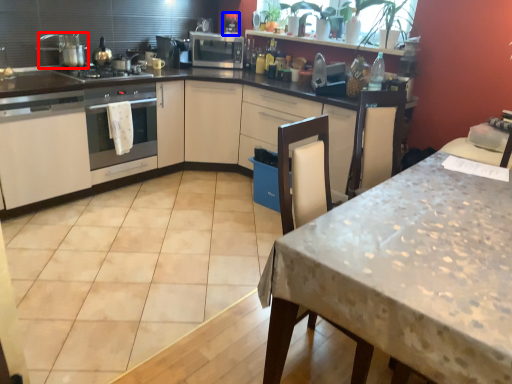
Question: Among these objects, which one is farthest to the camera, kitchen appliance (highlighted by a red box) or coffee machine (highlighted by a blue box)?

Choices:
 (A) kitchen appliance
 (B) coffee machine

Answer: (B)